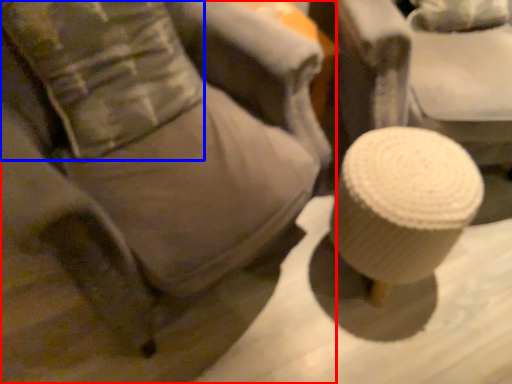
Question: Among these objects, which one is nearest to the camera, furniture (highlighted by a red box) or pillow (highlighted by a blue box)?

Choices:
 (A) furniture
 (B) pillow

Answer: (A)